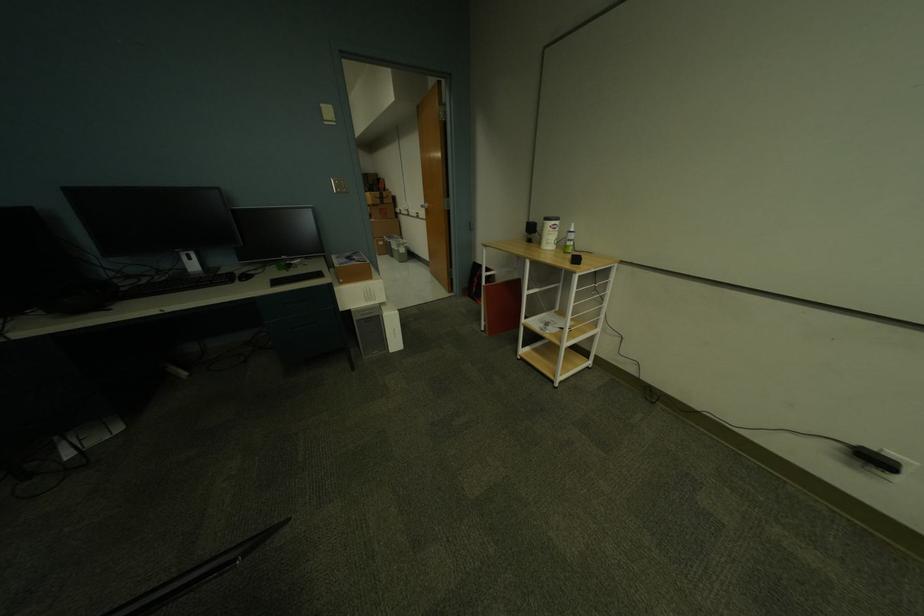
Where is `white wipes container`? white wipes container is located at coordinates (550, 235).